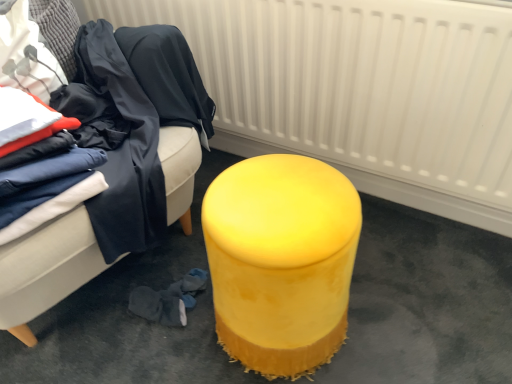
Question: Does velvet yellow ottoman at right appear on the left side of dark blue fabric at left?

Choices:
 (A) yes
 (B) no

Answer: (A)

Question: Could you tell me if velvet yellow ottoman at right is facing dark blue fabric at left?

Choices:
 (A) no
 (B) yes

Answer: (A)

Question: From the image's perspective, is velvet yellow ottoman at right on top of dark blue fabric at left?

Choices:
 (A) yes
 (B) no

Answer: (B)

Question: Can you see velvet yellow ottoman at right touching dark blue fabric at left?

Choices:
 (A) no
 (B) yes

Answer: (A)

Question: Does velvet yellow ottoman at right have a larger size compared to dark blue fabric at left?

Choices:
 (A) no
 (B) yes

Answer: (B)

Question: Would you say white textured radiator at upper center is to the left or to the right of velvet yellow ottoman at right in the picture?

Choices:
 (A) right
 (B) left

Answer: (A)

Question: From a real-world perspective, relative to velvet yellow ottoman at right, is white textured radiator at upper center vertically above or below?

Choices:
 (A) above
 (B) below

Answer: (B)

Question: Is white textured radiator at upper center taller or shorter than velvet yellow ottoman at right?

Choices:
 (A) short
 (B) tall

Answer: (A)

Question: Considering the positions of point (482, 84) and point (62, 286), is point (482, 84) closer or farther from the camera than point (62, 286)?

Choices:
 (A) closer
 (B) farther

Answer: (A)

Question: Looking at the image, does yellow velvet ottoman at center seem bigger or smaller compared to white textured radiator at upper center?

Choices:
 (A) small
 (B) big

Answer: (A)

Question: Is yellow velvet ottoman at center in front of or behind white textured radiator at upper center in the image?

Choices:
 (A) behind
 (B) front

Answer: (B)

Question: From the image's perspective, is yellow velvet ottoman at center located above or below white textured radiator at upper center?

Choices:
 (A) below
 (B) above

Answer: (A)

Question: Looking at their shapes, would you say yellow velvet ottoman at center is wider or thinner than white textured radiator at upper center?

Choices:
 (A) thin
 (B) wide

Answer: (B)

Question: Choose the correct answer: Is velvet yellow ottoman at right inside yellow velvet ottoman at center or outside it?

Choices:
 (A) outside
 (B) inside

Answer: (A)

Question: From the image's perspective, is velvet yellow ottoman at right positioned above or below yellow velvet ottoman at center?

Choices:
 (A) above
 (B) below

Answer: (A)